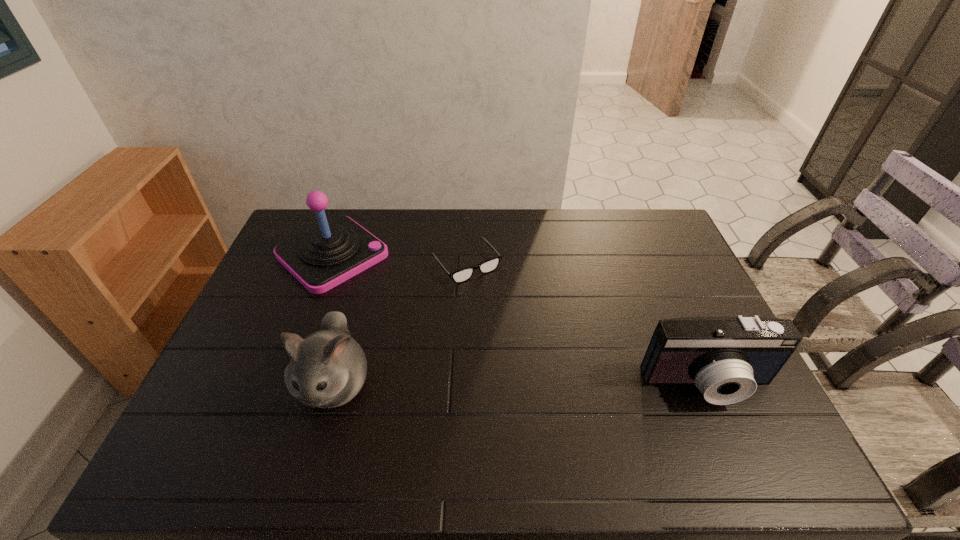
You are a GUI agent. You are given a task and a screenshot of the screen. Output one action in this format:
    pyautogui.click(x=<x>, y=<y>)
    Task: Click on the vacant space at the near edge
    
    Given the screenshot: What is the action you would take?
    pyautogui.click(x=575, y=398)

This screenshot has height=540, width=960. Identify the location of vacant space at the left edge. (285, 320).

The image size is (960, 540). What are the coordinates of `vacant space at the right edge` in the screenshot? It's located at (699, 291).

I want to click on free space at the far right corner of the desktop, so click(x=675, y=247).

The width and height of the screenshot is (960, 540). Identify the location of free space at the near right corner of the desktop. (702, 409).

This screenshot has width=960, height=540. I want to click on free spot between the hamster and the camcorder, so click(521, 384).

The width and height of the screenshot is (960, 540). What are the coordinates of `empty space that is in between the second object from right to left and the joystick` in the screenshot? It's located at (399, 259).

Where is `vacant region between the second object from right to left and the hamster`? vacant region between the second object from right to left and the hamster is located at coordinates (400, 324).

Identify the location of empty location between the spectacles and the joystick. (399, 259).

I want to click on unoccupied area between the joystick and the third object from left to right, so click(x=399, y=259).